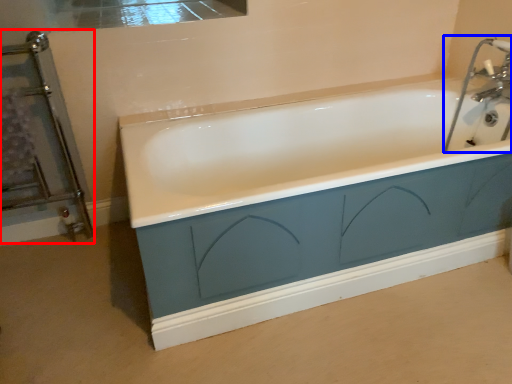
Question: Which point is further to the camera, screen door (highlighted by a red box) or sink (highlighted by a blue box)?

Choices:
 (A) screen door
 (B) sink

Answer: (B)